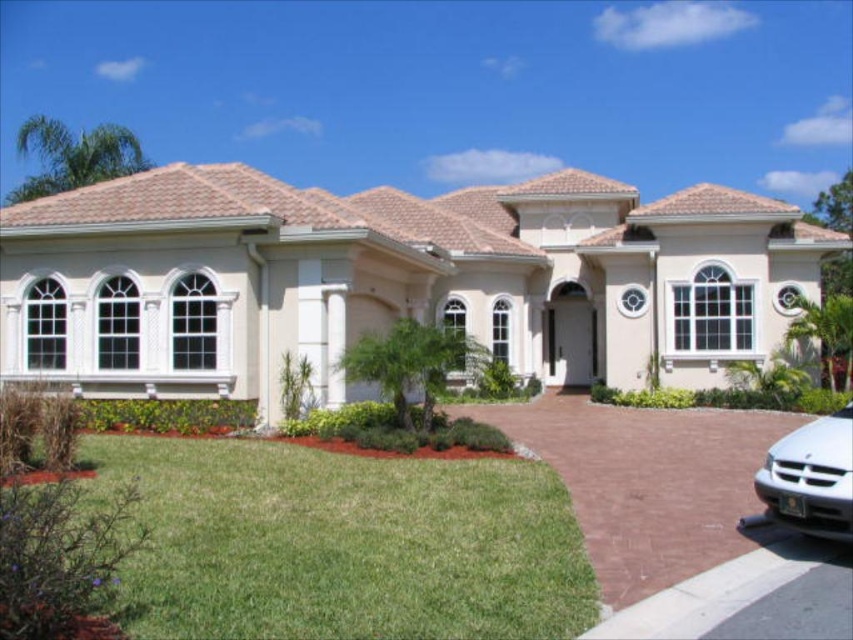
You are a delivery person approaching the house and need to park your vehicle. Based on the image, where is the brown concrete driveway at lower right located relative to the house?

The brown concrete driveway at lower right is located at point (646, 481) relative to the house.

You are standing at the front of the house and want to walk to the brown concrete driveway at lower right. Which direction should you head from the green grass at lower left?

The green grass at lower left is to the left of the brown concrete driveway at lower right, so you should head to the right from the green grass at lower left to reach the brown concrete driveway at lower right.